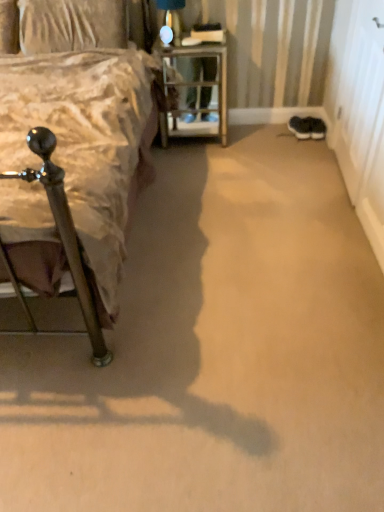
Question: Does black suede sneakers at lower right, marked as the first footwear in a right-to-left arrangement, have a smaller size compared to metallic silver bed at left?

Choices:
 (A) no
 (B) yes

Answer: (B)

Question: Does black suede sneakers at lower right, which is the 2th footwear from left to right, touch metallic silver bed at left?

Choices:
 (A) yes
 (B) no

Answer: (B)

Question: Can we say black suede sneakers at lower right, marked as the first footwear in a right-to-left arrangement, lies outside metallic silver bed at left?

Choices:
 (A) yes
 (B) no

Answer: (A)

Question: From the image's perspective, would you say black suede sneakers at lower right, which is the 2th footwear from left to right, is shown under metallic silver bed at left?

Choices:
 (A) no
 (B) yes

Answer: (A)

Question: Is black suede sneakers at lower right, marked as the first footwear in a right-to-left arrangement, to the right of metallic silver bed at left from the viewer's perspective?

Choices:
 (A) yes
 (B) no

Answer: (A)

Question: Relative to metal/textured nightstand at center, is black suede sneakers at lower right, marked as the first footwear in a right-to-left arrangement, in front or behind?

Choices:
 (A) front
 (B) behind

Answer: (B)

Question: From a real-world perspective, is black suede sneakers at lower right, marked as the first footwear in a right-to-left arrangement, physically located above or below metal/textured nightstand at center?

Choices:
 (A) above
 (B) below

Answer: (B)

Question: Choose the correct answer: Is black suede sneakers at lower right, marked as the first footwear in a right-to-left arrangement, inside metal/textured nightstand at center or outside it?

Choices:
 (A) inside
 (B) outside

Answer: (B)

Question: Considering the positions of black suede sneakers at lower right, marked as the first footwear in a right-to-left arrangement, and metal/textured nightstand at center in the image, is black suede sneakers at lower right, marked as the first footwear in a right-to-left arrangement, wider or thinner than metal/textured nightstand at center?

Choices:
 (A) thin
 (B) wide

Answer: (A)

Question: Considering the positions of black suede sneakers at lower right, marked as the first footwear in a right-to-left arrangement, and black suede sneakers at lower right, the 1th footwear viewed from the left, in the image, is black suede sneakers at lower right, marked as the first footwear in a right-to-left arrangement, bigger or smaller than black suede sneakers at lower right, the 1th footwear viewed from the left,?

Choices:
 (A) small
 (B) big

Answer: (A)

Question: In the image, is black suede sneakers at lower right, which is the 2th footwear from left to right, on the left side or the right side of black suede sneakers at lower right, the 1th footwear viewed from the left?

Choices:
 (A) right
 (B) left

Answer: (A)

Question: Considering the positions of black suede sneakers at lower right, which is the 2th footwear from left to right, and black suede sneakers at lower right, which is the second footwear in right-to-left order, in the image, is black suede sneakers at lower right, which is the 2th footwear from left to right, wider or thinner than black suede sneakers at lower right, which is the second footwear in right-to-left order,?

Choices:
 (A) thin
 (B) wide

Answer: (A)

Question: From a real-world perspective, is black suede sneakers at lower right, which is the 2th footwear from left to right, positioned above or below black suede sneakers at lower right, which is the second footwear in right-to-left order?

Choices:
 (A) below
 (B) above

Answer: (A)

Question: Is point (21, 34) closer or farther from the camera than point (314, 119)?

Choices:
 (A) closer
 (B) farther

Answer: (A)

Question: From the image's perspective, is textured beige pillow at upper left above or below black suede sneakers at lower right, which is the 2th footwear from left to right?

Choices:
 (A) above
 (B) below

Answer: (A)